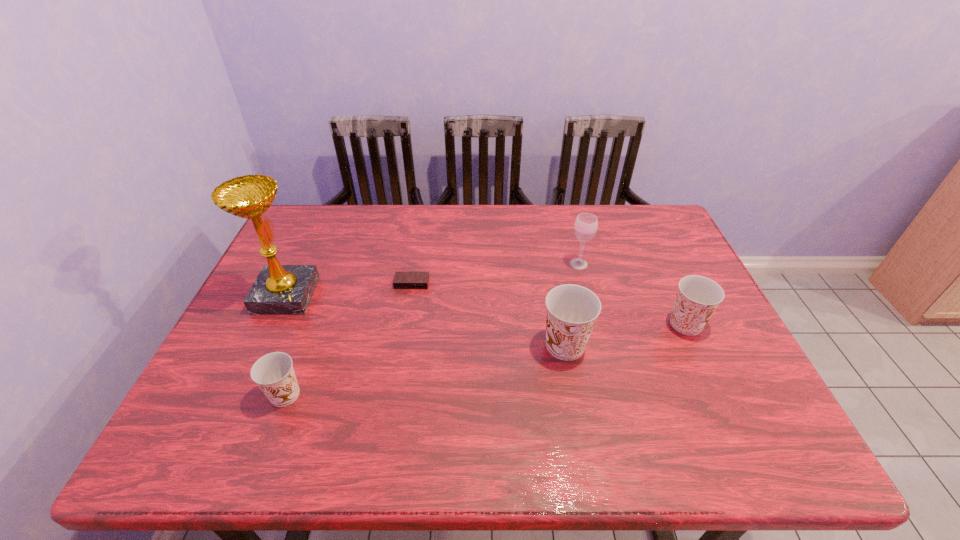
Image resolution: width=960 pixels, height=540 pixels. In order to click on vacant space at the far edge of the desktop in this screenshot , I will do `click(557, 244)`.

Find the location of a particular element. The image size is (960, 540). free space at the near edge of the desktop is located at coordinates (523, 383).

Where is `free space at the left edge of the desktop`? The height and width of the screenshot is (540, 960). free space at the left edge of the desktop is located at coordinates (254, 325).

In the image, there is a desktop. Where is `vacant space at the right edge`? The width and height of the screenshot is (960, 540). vacant space at the right edge is located at coordinates point(667,262).

Locate an element on the screen. Image resolution: width=960 pixels, height=540 pixels. free region at the far left corner is located at coordinates (309, 205).

The width and height of the screenshot is (960, 540). What are the coordinates of `vacant space at the far right corner of the desktop` in the screenshot? It's located at (656, 246).

You are a GUI agent. You are given a task and a screenshot of the screen. Output one action in this format:
    pyautogui.click(x=<x>, y=<y>)
    Task: Click on the vacant space at the near right corner
    Image resolution: width=960 pixels, height=540 pixels.
    Given the screenshot: What is the action you would take?
    pyautogui.click(x=750, y=384)

I want to click on vacant space that's between the second Dixie cup from right to left and the award, so click(x=425, y=320).

This screenshot has height=540, width=960. Identify the location of vacant space that's between the second shortest object and the farthest object. (432, 329).

Where is `free space between the shortest Dixie cup and the award`? free space between the shortest Dixie cup and the award is located at coordinates pos(286,345).